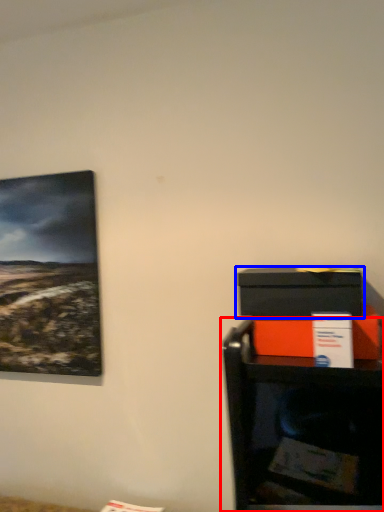
Question: Which point is further to the camera, furniture (highlighted by a red box) or box (highlighted by a blue box)?

Choices:
 (A) furniture
 (B) box

Answer: (A)